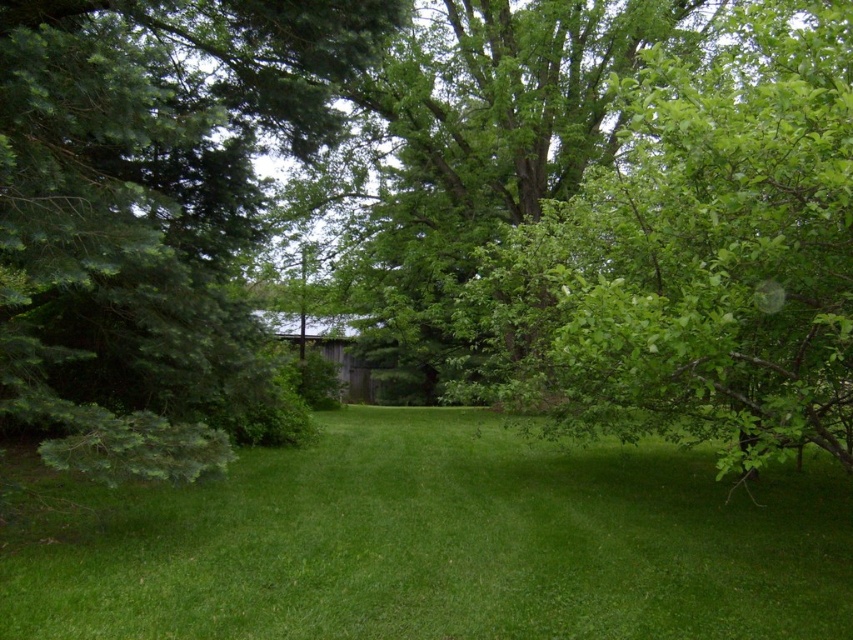
Is the position of green grass at center less distant than that of green leafy tree at right?

That is False.

Locate an element on the screen. green grass at center is located at coordinates (444, 545).

Identify the location of green grass at center. pos(444,545).

What do you see at coordinates (152, 212) in the screenshot?
I see `green leafy tree at left` at bounding box center [152, 212].

This screenshot has height=640, width=853. I want to click on green leafy tree at left, so click(152, 212).

Does green grass at center come in front of green leafy tree at left?

That is True.

Is green grass at center smaller than green leafy tree at left?

Incorrect, green grass at center is not smaller in size than green leafy tree at left.

Which is in front, point (532, 492) or point (193, 157)?

Positioned in front is point (193, 157).

Where is `green grass at center`? The height and width of the screenshot is (640, 853). green grass at center is located at coordinates (444, 545).